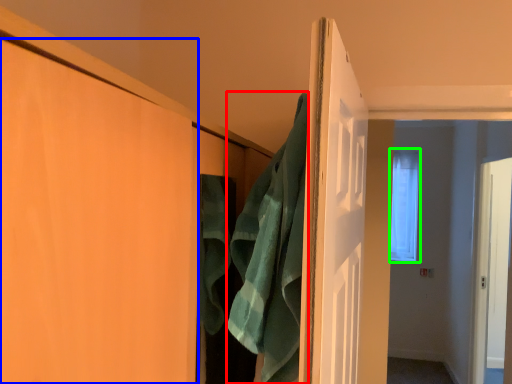
Question: Which object is positioned closest to bath towel (highlighted by a red box)? Select from door (highlighted by a blue box) and window (highlighted by a green box).

Choices:
 (A) door
 (B) window

Answer: (A)